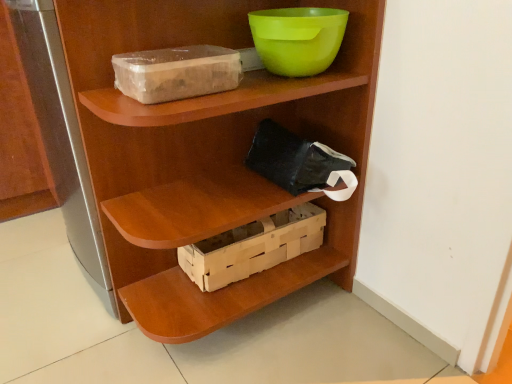
Question: Is wooden shelf at center completely or partially outside of wooden crate at center?

Choices:
 (A) yes
 (B) no

Answer: (A)

Question: From the image's perspective, is wooden shelf at center above wooden crate at center?

Choices:
 (A) no
 (B) yes

Answer: (B)

Question: Is wooden shelf at center taller than wooden crate at center?

Choices:
 (A) no
 (B) yes

Answer: (B)

Question: Is there a large distance between wooden shelf at center and wooden crate at center?

Choices:
 (A) yes
 (B) no

Answer: (B)

Question: Does wooden shelf at center appear on the right side of wooden crate at center?

Choices:
 (A) yes
 (B) no

Answer: (B)

Question: Does wooden shelf at center have a lesser height compared to wooden crate at center?

Choices:
 (A) yes
 (B) no

Answer: (B)

Question: Can you confirm if transparent plastic storage box at upper left is positioned to the right of green plastic bowl at upper center?

Choices:
 (A) yes
 (B) no

Answer: (B)

Question: From a real-world perspective, is transparent plastic storage box at upper left physically below green plastic bowl at upper center?

Choices:
 (A) no
 (B) yes

Answer: (B)

Question: Is transparent plastic storage box at upper left looking in the opposite direction of green plastic bowl at upper center?

Choices:
 (A) yes
 (B) no

Answer: (B)

Question: Can you confirm if transparent plastic storage box at upper left is positioned to the left of green plastic bowl at upper center?

Choices:
 (A) no
 (B) yes

Answer: (B)

Question: Does transparent plastic storage box at upper left have a lesser width compared to green plastic bowl at upper center?

Choices:
 (A) no
 (B) yes

Answer: (B)

Question: Does transparent plastic storage box at upper left have a greater width compared to green plastic bowl at upper center?

Choices:
 (A) yes
 (B) no

Answer: (B)

Question: Would you say wooden crate at center is a long distance from wooden shelf at center?

Choices:
 (A) no
 (B) yes

Answer: (A)